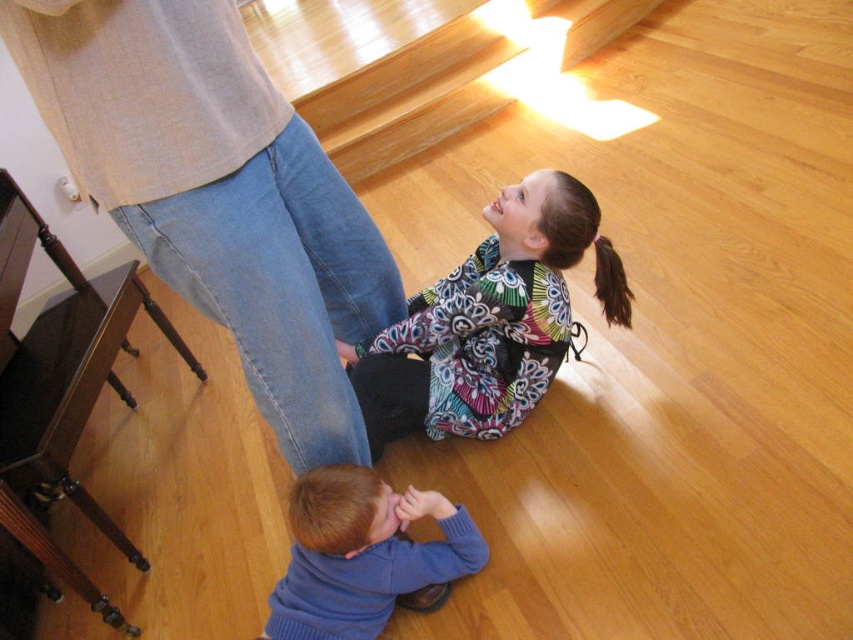
Which is in front, point (323, 417) or point (555, 355)?

Positioned in front is point (323, 417).

Which is more to the left, light blue denim jeans at upper left or multicolored fabric dress at center?

light blue denim jeans at upper left

Identify the location of light blue denim jeans at upper left. (218, 195).

I want to click on light blue denim jeans at upper left, so click(218, 195).

Does multicolored fabric dress at center have a larger size compared to blue sweater at lower center?

Yes.

You are a GUI agent. You are given a task and a screenshot of the screen. Output one action in this format:
    pyautogui.click(x=<x>, y=<y>)
    Task: Click on the multicolored fabric dress at center
    The image size is (853, 640).
    Given the screenshot: What is the action you would take?
    pyautogui.click(x=489, y=321)

Describe the element at coordinates (218, 195) in the screenshot. This screenshot has width=853, height=640. I see `light blue denim jeans at upper left` at that location.

Can you confirm if light blue denim jeans at upper left is smaller than blue sweater at lower center?

No, light blue denim jeans at upper left is not smaller than blue sweater at lower center.

Is point (189, 48) behind point (409, 502)?

No, (189, 48) is in front of (409, 502).

Identify the location of light blue denim jeans at upper left. (218, 195).